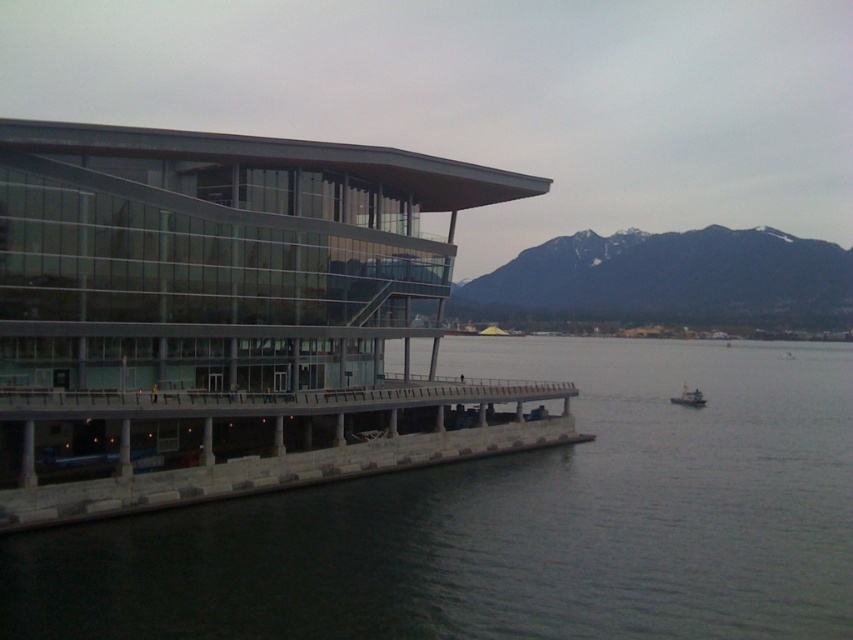
You are standing at the point marked by the coordinates point (x=666, y=276) in the image. Looking around, what large natural feature would you see directly in front of you?

The point (x=666, y=276) marks the dark gray rocky mountain at upper center, so standing there you would see the dark gray rocky mountain at upper center directly in front of you.

You are an architect evaluating the site for a new observation deck. The deck must be positioned so that the dark gray rocky mountain at upper center remains visible from the concrete dock at lower left. Based on the scene, is this feasible?

The dark gray rocky mountain at upper center is taller than the concrete dock at lower left, so positioning the observation deck at the concrete dock at lower left would allow visibility of the mountain since its height would not obstruct the view.